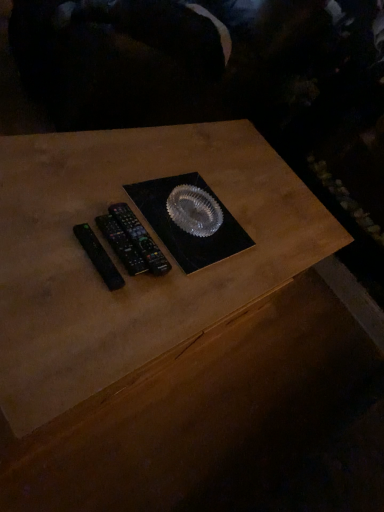
At what (x,y) coordinates should I click in order to perform the action: click on vacant region to the left of black plastic remote at left, positioned as the second control in front-to-back order. Please return your answer as a coordinate pair (x, y). Image resolution: width=384 pixels, height=512 pixels. Looking at the image, I should click on (57, 200).